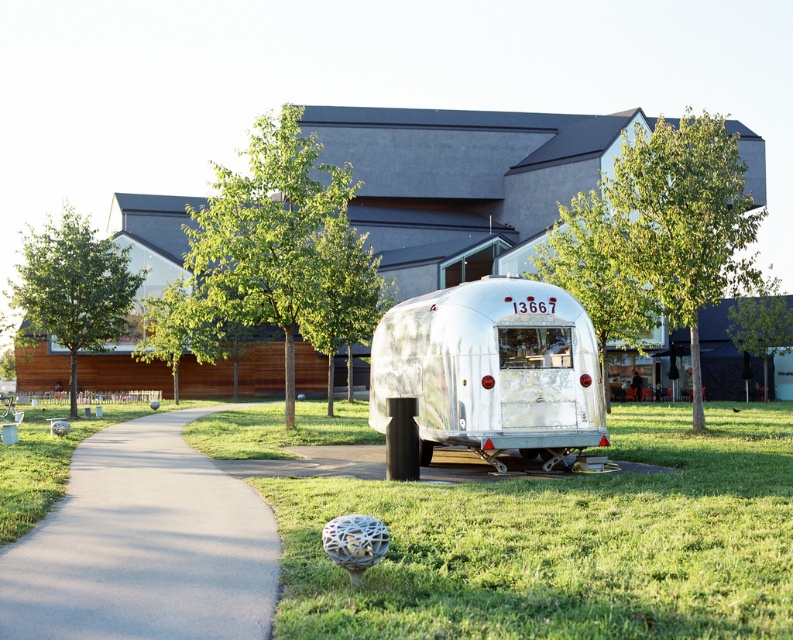
Is the position of gray asphalt pavement at center more distant than that of silver metallic trailer at center?

No.

How much distance is there between gray asphalt pavement at center and silver metallic trailer at center?

A distance of 5.50 meters exists between gray asphalt pavement at center and silver metallic trailer at center.

Identify the location of gray asphalt pavement at center. (144, 545).

Is green grass at center above gray asphalt pavement at center?

Yes.

Does point (673, 636) lie in front of point (58, 614)?

Yes, it is in front of point (58, 614).

At what (x,y) coordinates should I click in order to perform the action: click on green grass at center. Please return your answer as a coordinate pair (x, y). Image resolution: width=793 pixels, height=640 pixels. Looking at the image, I should click on (564, 541).

Does green grass at center appear under silver metallic trailer at center?

Yes.

Between point (649, 612) and point (374, 339), which one is positioned in front?

Positioned in front is point (649, 612).

Identify the location of green grass at center. (564, 541).